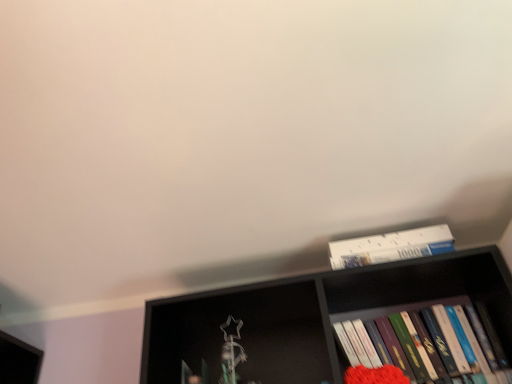
Question: Considering the relative sizes of white paperboard puzzle at upper right, the 2th book from the bottom, and black matte bookshelf at upper center in the image provided, is white paperboard puzzle at upper right, the 2th book from the bottom, bigger than black matte bookshelf at upper center?

Choices:
 (A) no
 (B) yes

Answer: (A)

Question: Is white paperboard puzzle at upper right, the 2th book from the bottom, not inside black matte bookshelf at upper center?

Choices:
 (A) yes
 (B) no

Answer: (A)

Question: Is white paperboard puzzle at upper right, the 2th book from the bottom, far away from black matte bookshelf at upper center?

Choices:
 (A) no
 (B) yes

Answer: (A)

Question: From the image's perspective, is white paperboard puzzle at upper right, the 2th book from the bottom, located above black matte bookshelf at upper center?

Choices:
 (A) no
 (B) yes

Answer: (B)

Question: From a real-world perspective, is white paperboard puzzle at upper right, the 2th book from the bottom, over black matte bookshelf at upper center?

Choices:
 (A) yes
 (B) no

Answer: (A)

Question: Is white paperboard puzzle at upper right, the 2th book from the bottom, positioned before black matte bookshelf at upper center?

Choices:
 (A) no
 (B) yes

Answer: (A)

Question: Considering the relative sizes of black matte bookshelf at upper center and white paperboard puzzle at upper right, the 2th book from the bottom, in the image provided, is black matte bookshelf at upper center smaller than white paperboard puzzle at upper right, the 2th book from the bottom,?

Choices:
 (A) yes
 (B) no

Answer: (B)

Question: Can you confirm if black matte bookshelf at upper center is wider than white paperboard puzzle at upper right, placed as the first book when sorted from top to bottom?

Choices:
 (A) no
 (B) yes

Answer: (B)

Question: Considering the relative sizes of black matte bookshelf at upper center and white paperboard puzzle at upper right, placed as the first book when sorted from top to bottom, in the image provided, is black matte bookshelf at upper center taller than white paperboard puzzle at upper right, placed as the first book when sorted from top to bottom,?

Choices:
 (A) no
 (B) yes

Answer: (B)

Question: Is white paperboard puzzle at upper right, placed as the first book when sorted from top to bottom, inside black matte bookshelf at upper center?

Choices:
 (A) no
 (B) yes

Answer: (A)

Question: Is black matte bookshelf at upper center oriented towards white paperboard puzzle at upper right, placed as the first book when sorted from top to bottom?

Choices:
 (A) yes
 (B) no

Answer: (B)

Question: Is black matte bookshelf at upper center located outside white paperboard puzzle at upper right, the 2th book from the bottom?

Choices:
 (A) no
 (B) yes

Answer: (B)

Question: Is there a large distance between white paperboard puzzle at upper right, the 2th book from the bottom, and hardcover books at right, the second book from the top?

Choices:
 (A) yes
 (B) no

Answer: (B)